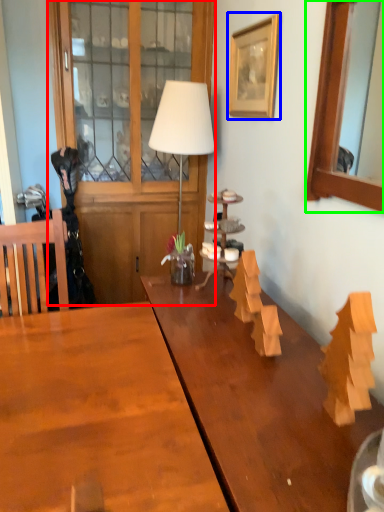
Question: Which object is positioned closest to dresser (highlighted by a red box)? Select from picture frame (highlighted by a blue box) and picture frame (highlighted by a green box).

Choices:
 (A) picture frame
 (B) picture frame

Answer: (A)